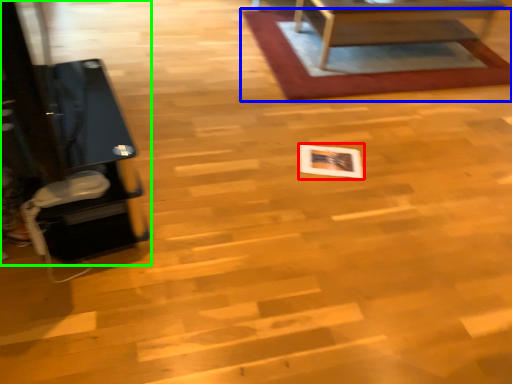
Question: Estimate the real-world distances between objects in this image. Which object is farther from square (highlighted by a red box), mat (highlighted by a blue box) or furniture (highlighted by a green box)?

Choices:
 (A) mat
 (B) furniture

Answer: (B)